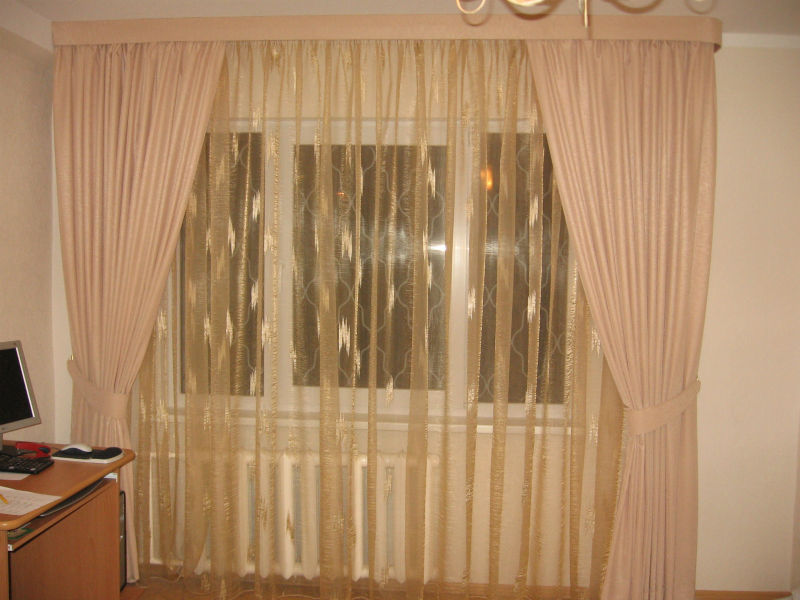
Identify the location of beige drapes. (646, 263), (146, 169).